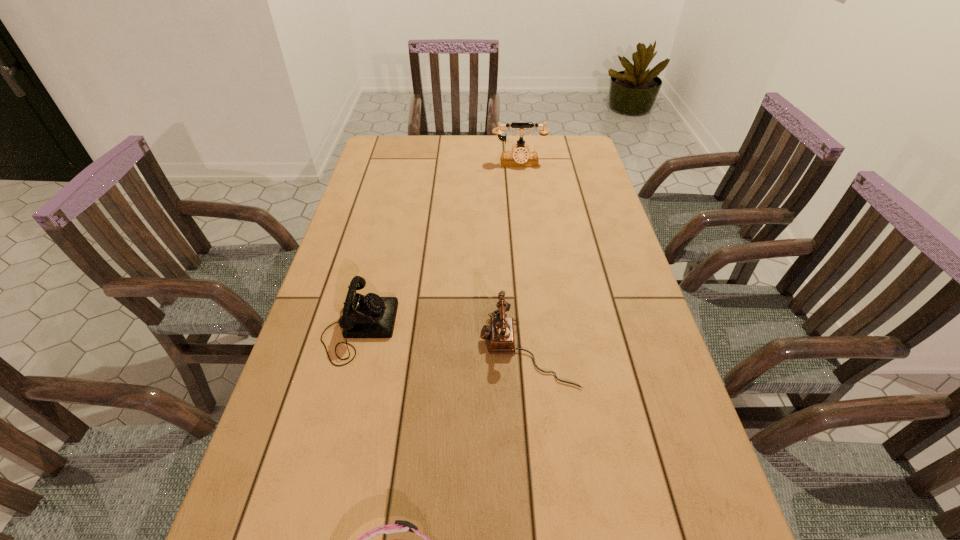
In the image, there is a desktop. Identify the location of vacant region at the far left corner. (378, 137).

What are the coordinates of `free space between the farthest telephone and the leftmost telephone` in the screenshot? It's located at (439, 246).

Where is `empty space that is in between the leftmost telephone and the tallest telephone`? This screenshot has width=960, height=540. empty space that is in between the leftmost telephone and the tallest telephone is located at coordinates (439, 246).

Locate an element on the screen. object that is the nearest to the dog collar is located at coordinates (500, 332).

Identify the location of object that stands as the closest to the nearest object. The height and width of the screenshot is (540, 960). (500, 332).

Identify which telephone is located as the second nearest to the dog collar. Please provide its 2D coordinates. Your answer should be formatted as a tuple, i.e. [(x, y)], where the tuple contains the x and y coordinates of a point satisfying the conditions above.

[(364, 316)]

Locate which telephone ranks second in proximity to the dog collar. Please provide its 2D coordinates. Your answer should be formatted as a tuple, i.e. [(x, y)], where the tuple contains the x and y coordinates of a point satisfying the conditions above.

[(364, 316)]

The width and height of the screenshot is (960, 540). I want to click on free region that satisfies the following two spatial constraints: 1. on the dial of the tallest object; 2. on the front face of the leftmost telephone, so click(540, 328).

Identify the location of vacant space that satisfies the following two spatial constraints: 1. on the dial of the farthest object; 2. on the front face of the leftmost telephone. This screenshot has width=960, height=540. (540, 328).

Find the location of a particular element. The image size is (960, 540). free spot that satisfies the following two spatial constraints: 1. on the dial of the farthest object; 2. on the front face of the leftmost telephone is located at coordinates (540, 328).